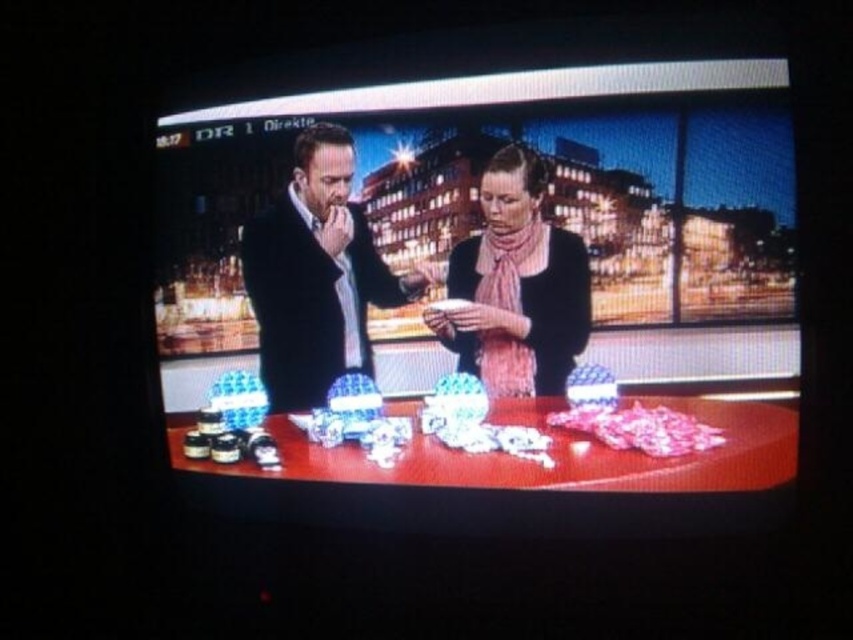
Describe the element at coordinates (316, 275) in the screenshot. This screenshot has height=640, width=853. I see `black woolen sweater at center` at that location.

Does black woolen sweater at center have a smaller size compared to pink striped scarf at center?

Actually, black woolen sweater at center might be larger than pink striped scarf at center.

Who is more forward, (280, 371) or (556, 358)?

Point (556, 358) is in front.

You are a GUI agent. You are given a task and a screenshot of the screen. Output one action in this format:
    pyautogui.click(x=<x>, y=<y>)
    Task: Click on the black woolen sweater at center
    This screenshot has height=640, width=853.
    Given the screenshot: What is the action you would take?
    pyautogui.click(x=316, y=275)

Is shiny plastic table at center positioned behind pink striped scarf at center?

No, shiny plastic table at center is closer to the viewer.

Who is more distant from viewer, [386,323] or [537,220]?

The point [386,323] is more distant.

Who is more distant from viewer, (589, 93) or (564, 298)?

The point (564, 298) is more distant.

At what (x,y) coordinates should I click in order to perform the action: click on shiny plastic table at center. Please return your answer as a coordinate pair (x, y). Looking at the image, I should click on (573, 182).

Can you confirm if shiny plastic table at center is thinner than black woolen sweater at center?

Incorrect, shiny plastic table at center's width is not less than black woolen sweater at center's.

Is shiny plastic table at center bigger than black woolen sweater at center?

Result: Yes, shiny plastic table at center is bigger than black woolen sweater at center.

Who is more forward, (785,280) or (283,339)?

Point (785,280) is more forward.

The width and height of the screenshot is (853, 640). I want to click on shiny plastic table at center, so click(x=573, y=182).